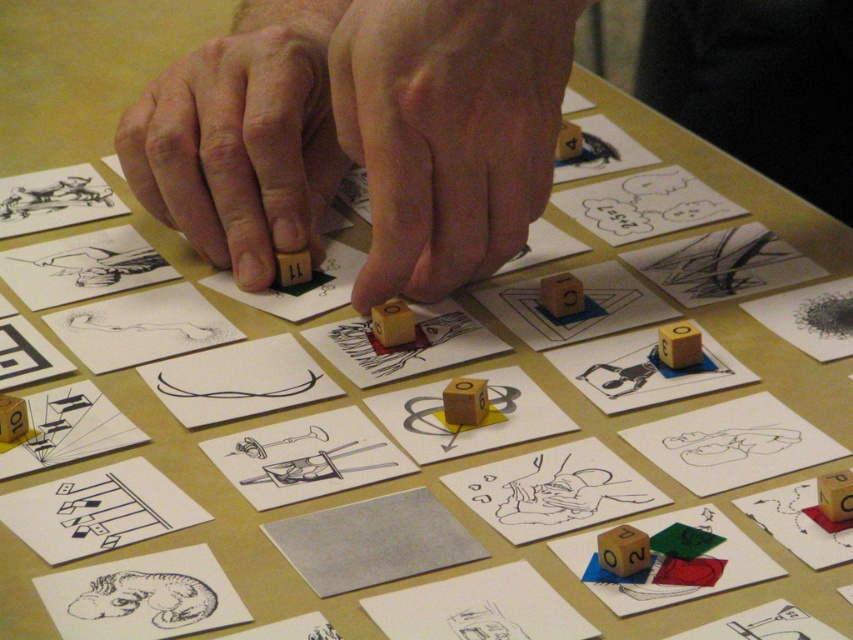
In the scene shown: Between wooden block at center and black textured dinosaur at bottom left, which one appears on the right side from the viewer's perspective?

Positioned to the right is black textured dinosaur at bottom left.

How much distance is there between wooden block at center and black textured dinosaur at bottom left?

wooden block at center and black textured dinosaur at bottom left are 16.93 inches apart from each other.

Is point (196, 218) positioned before point (157, 616)?

No.

Identify the location of wooden block at center. Image resolution: width=853 pixels, height=640 pixels. (239, 145).

Between point (508, 225) and point (125, 614), which one is positioned behind?

The point (508, 225) is behind.

Is wooden at center below black textured dinosaur at bottom left?

Actually, wooden at center is above black textured dinosaur at bottom left.

Who is more forward, [467,74] or [177,579]?

Point [177,579]

Identify the location of wooden at center. (448, 131).

Is wooden at center below wooden block at center?

Yes, wooden at center is below wooden block at center.

Is wooden at center positioned behind wooden block at center?

No, it is in front of wooden block at center.

Is point (389, 42) in front of point (210, 83)?

Yes, point (389, 42) is closer to viewer.

Where is `wooden at center`? The width and height of the screenshot is (853, 640). wooden at center is located at coordinates (448, 131).